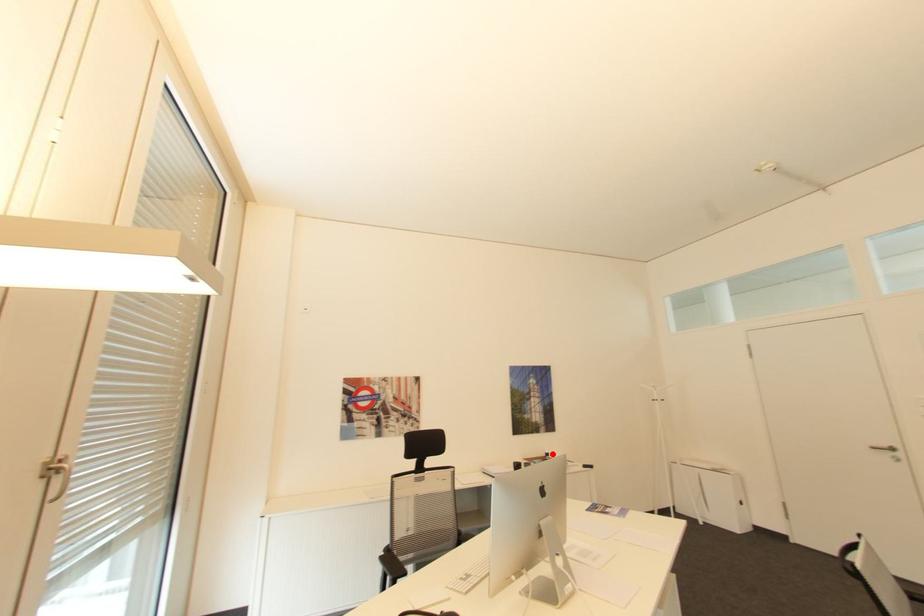
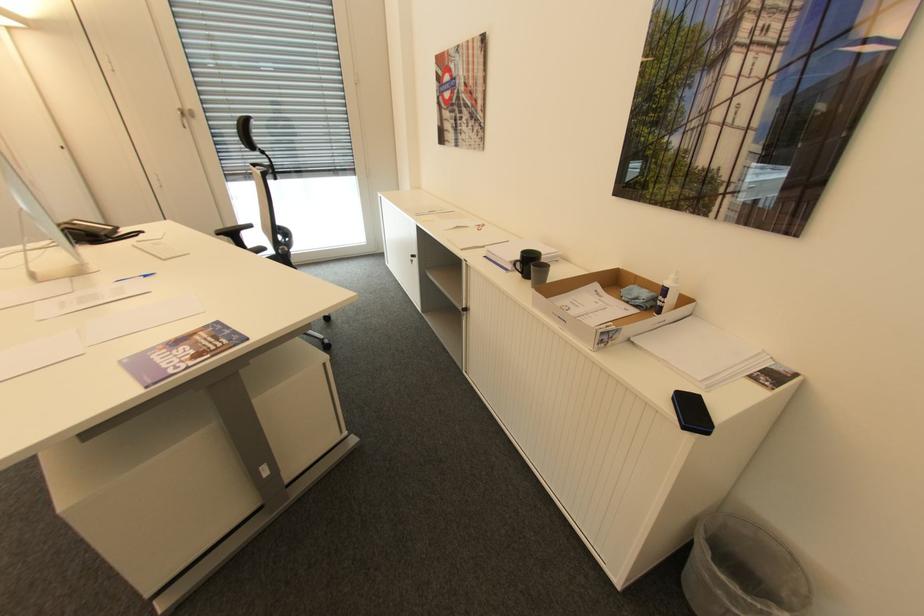
Question: I am providing you with two images of the same scene from different viewpoints. A red point is shown in image1. For the corresponding object point in image2, is it positioned nearer or farther from the camera?

Choices:
 (A) Nearer
 (B) Farther

Answer: (A)